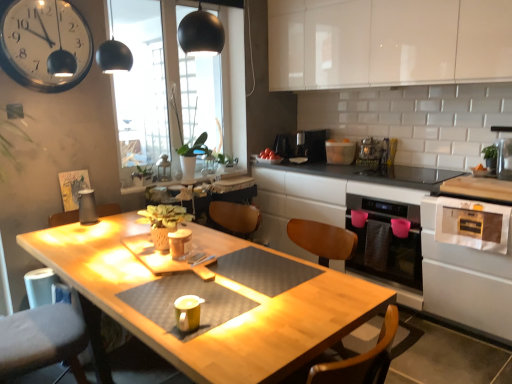
I want to click on free space to the back side of matte yellow cup at center, which ranks as the 3th appliance in left-to-right order, so click(201, 301).